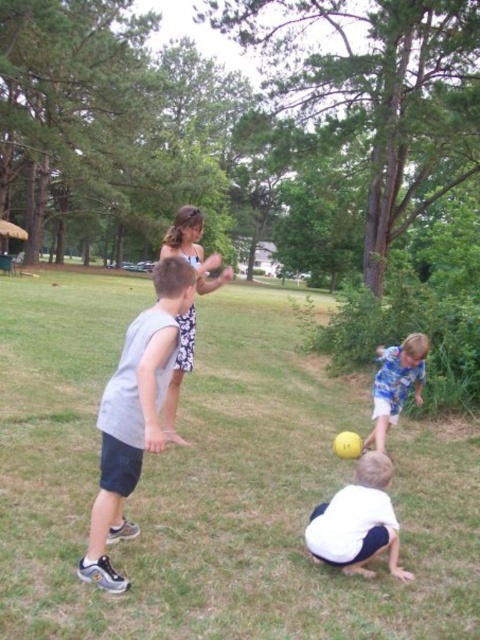
Question: Among these points, which one is farthest from the camera?

Choices:
 (A) (x=105, y=472)
 (B) (x=384, y=621)

Answer: (A)

Question: Which object is closer to the camera taking this photo?

Choices:
 (A) blue cotton shirt at lower right
 (B) white matte shirt at lower center
 (C) green grass at center
 (D) gray fabric shirt at center

Answer: (C)

Question: Is gray fabric shirt at center wider than blue cotton shirt at lower right?

Choices:
 (A) no
 (B) yes

Answer: (B)

Question: Is gray fabric shirt at center wider than patterned fabric dress at center?

Choices:
 (A) yes
 (B) no

Answer: (B)

Question: Is gray fabric shirt at center to the left of blue cotton shirt at lower right from the viewer's perspective?

Choices:
 (A) no
 (B) yes

Answer: (B)

Question: Which object is positioned closest to the gray fabric shirt at center?

Choices:
 (A) white matte shirt at lower center
 (B) green grass at center
 (C) blue cotton shirt at lower right
 (D) patterned fabric dress at center

Answer: (A)